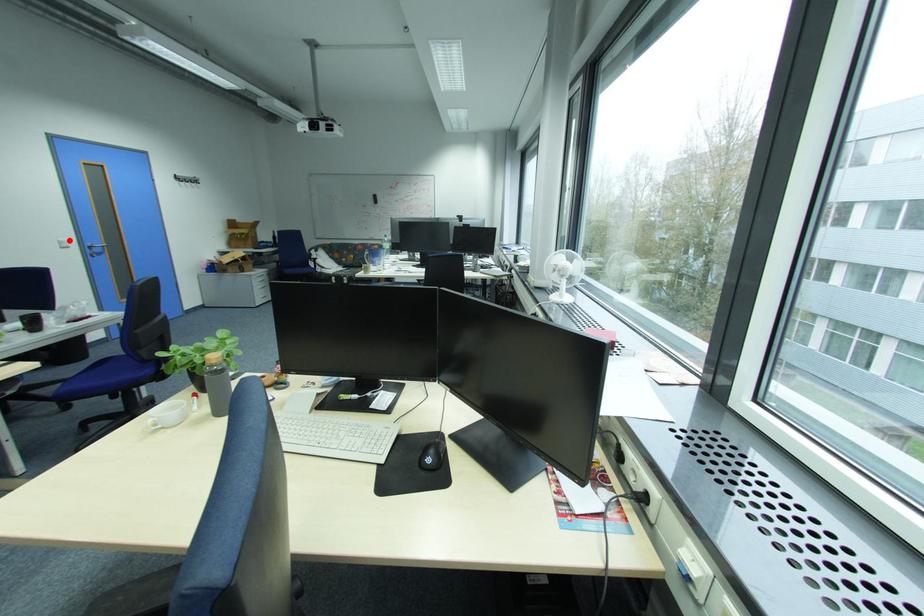
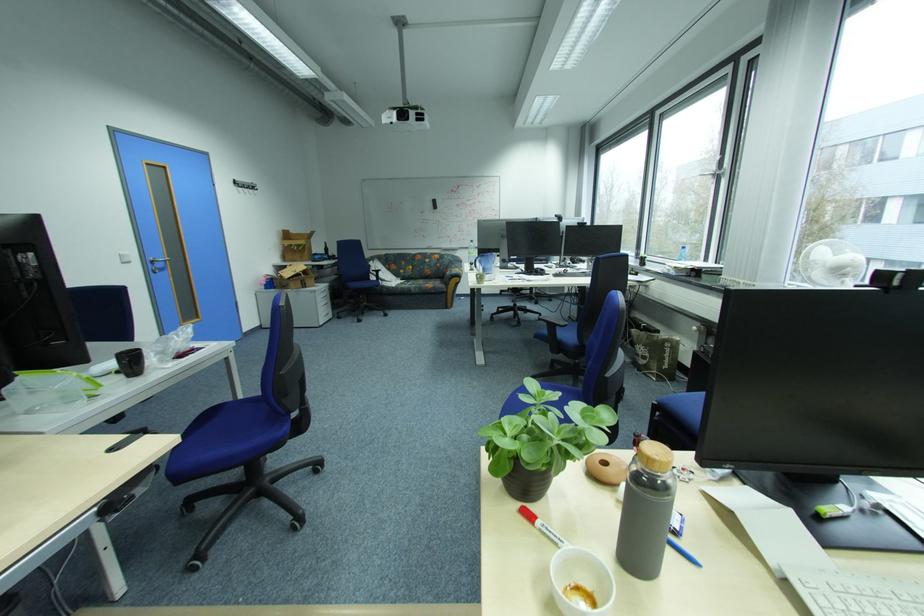
Question: I am providing you with two images of the same scene from different viewpoints. Image1 has a red point marked. In image2, the corresponding 3D location appears at what relative position? Reply with the corresponding letter.

Choices:
 (A) Closer
 (B) Farther

Answer: (A)